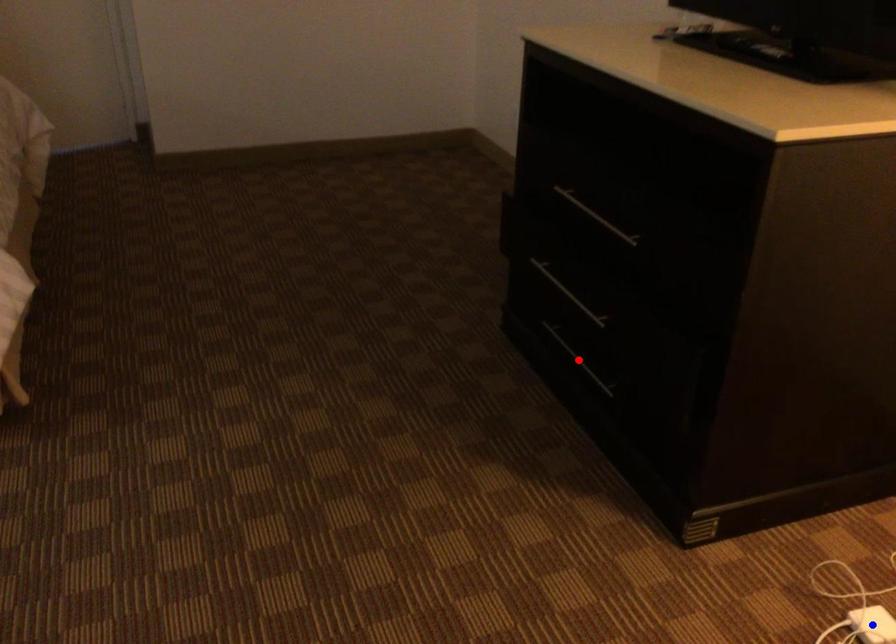
Question: In the image, two points are highlighted. Which point is nearer to the camera? Reply with the corresponding letter.

Choices:
 (A) blue point
 (B) red point

Answer: (A)